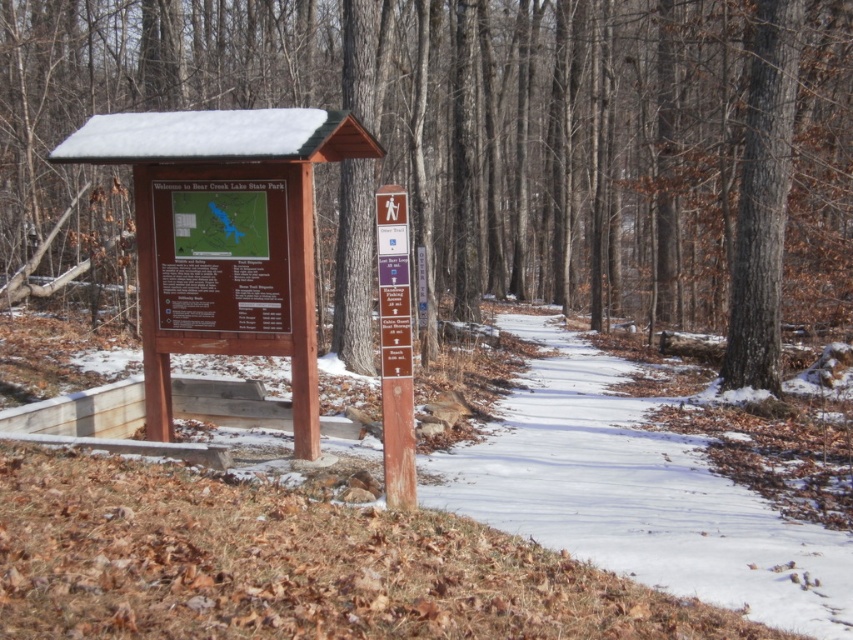
Who is shorter, brown wood tree at center or wooden signpost at center?

With less height is wooden signpost at center.

What do you see at coordinates (605, 164) in the screenshot?
I see `brown wood tree at center` at bounding box center [605, 164].

Identify the location of brown wood tree at center. The height and width of the screenshot is (640, 853). (605, 164).

Which of these two, snowy dirt path at center or wooden signpost at center, stands shorter?

Standing shorter between the two is snowy dirt path at center.

Locate an element on the screen. snowy dirt path at center is located at coordinates click(x=635, y=493).

The height and width of the screenshot is (640, 853). Identify the location of snowy dirt path at center. (635, 493).

Who is lower down, brown wood tree at center or snowy dirt path at center?

snowy dirt path at center is below.

The image size is (853, 640). Describe the element at coordinates (605, 164) in the screenshot. I see `brown wood tree at center` at that location.

Who is more distant from viewer, (469, 36) or (717, 524)?

The point (469, 36) is behind.

At what (x,y) coordinates should I click in order to perform the action: click on brown wood tree at center. Please return your answer as a coordinate pair (x, y). The image size is (853, 640). Looking at the image, I should click on (605, 164).